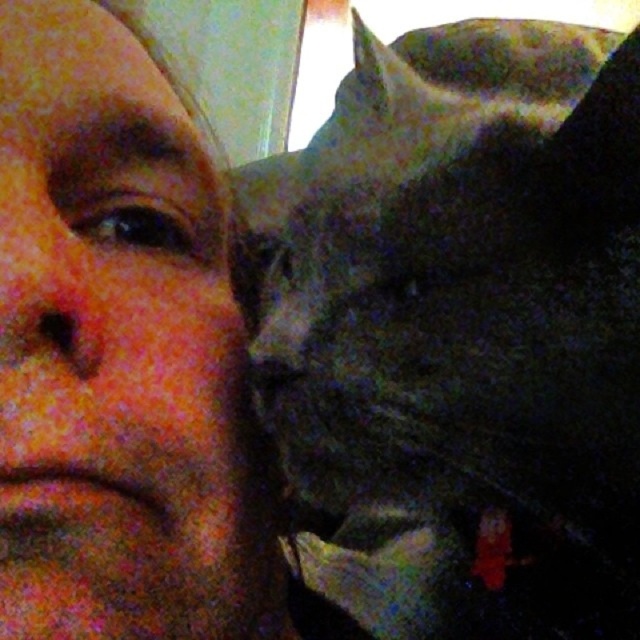
Question: Is the position of dark gray fur at right less distant than that of matte skin at center?

Choices:
 (A) no
 (B) yes

Answer: (A)

Question: Is dark gray fur at right wider than matte skin at center?

Choices:
 (A) no
 (B) yes

Answer: (B)

Question: Does dark gray fur at right have a lesser width compared to matte skin at center?

Choices:
 (A) no
 (B) yes

Answer: (A)

Question: Which point is farther to the camera?

Choices:
 (A) (97, 64)
 (B) (531, 378)

Answer: (A)

Question: Which object appears closest to the camera in this image?

Choices:
 (A) dark gray fur at right
 (B) matte skin at center

Answer: (B)